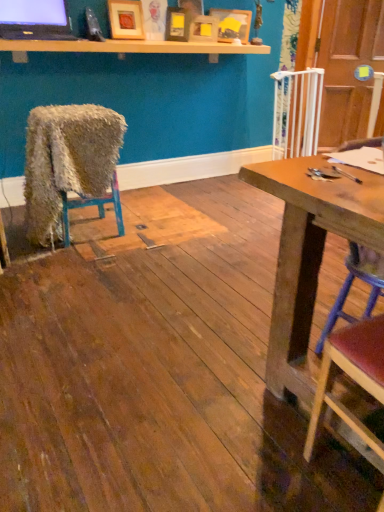
The width and height of the screenshot is (384, 512). I want to click on vacant region in front of matte wooden picture frame at upper center, the third picture frame when ordered from right to left, so click(x=170, y=47).